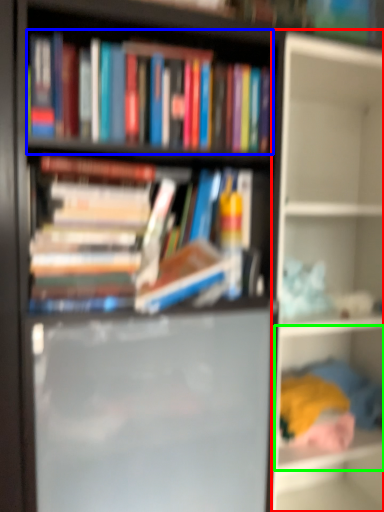
Question: Based on their relative distances, which object is farther from shelf (highlighted by a red box)? Choose from book (highlighted by a blue box) and shelf (highlighted by a green box).

Choices:
 (A) book
 (B) shelf

Answer: (A)